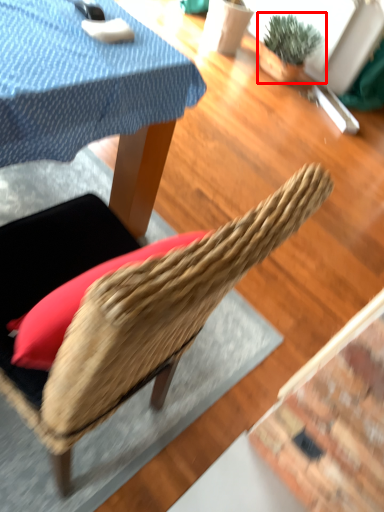
Question: Observing the image, what is the correct spatial positioning of houseplant (annotated by the red box) in reference to chair?

Choices:
 (A) right
 (B) left

Answer: (A)